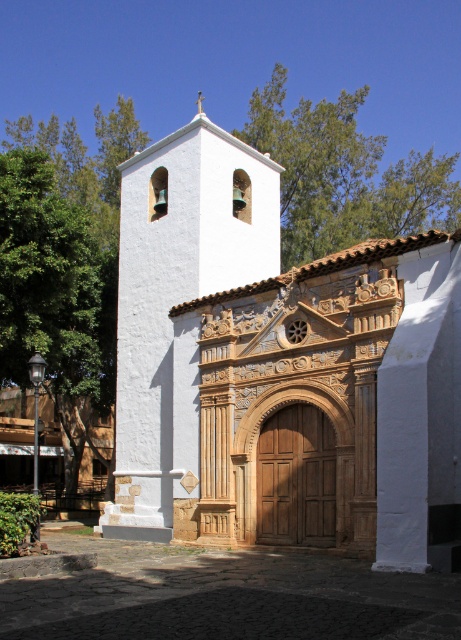
Which is behind, point (408, 516) or point (177, 266)?

The point (177, 266) is behind.

Consider the image. Does white stucco church at center have a larger size compared to white stucco bell tower at upper left?

Yes.

Between point (348, 291) and point (151, 179), which one is positioned behind?

Point (151, 179)

You are a GUI agent. You are given a task and a screenshot of the screen. Output one action in this format:
    pyautogui.click(x=<x>, y=<y>)
    Task: Click on the white stucco church at center
    
    Given the screenshot: What is the action you would take?
    pyautogui.click(x=278, y=369)